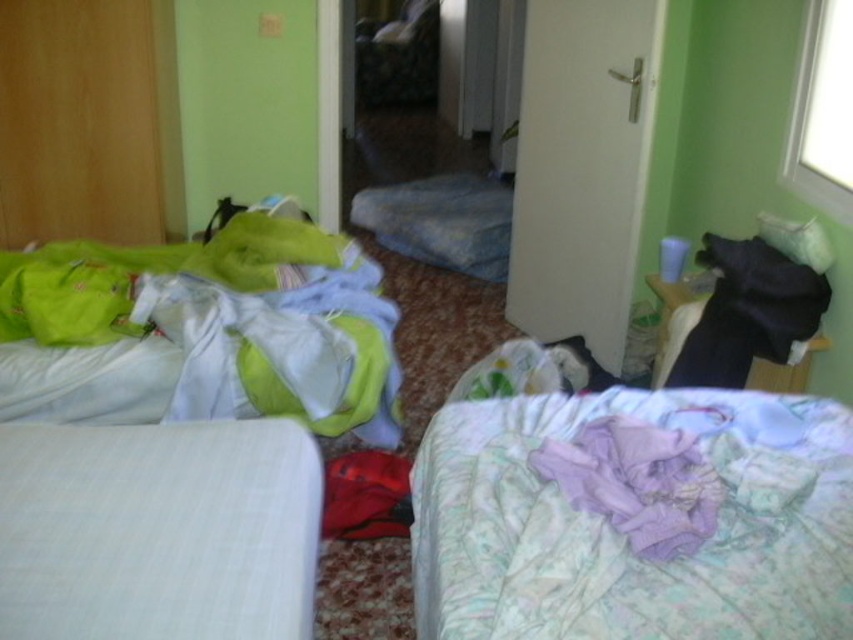
Question: Which of the following is the closest to the observer?

Choices:
 (A) matte green fabric at left
 (B) light purple floral blanket at lower right

Answer: (B)

Question: Considering the real-world distances, which object is closest to the white cotton bedcover at lower left?

Choices:
 (A) matte green fabric at left
 (B) light purple floral blanket at lower right

Answer: (B)

Question: Is matte green fabric at left below white cotton bedcover at lower left?

Choices:
 (A) no
 (B) yes

Answer: (A)

Question: Is light purple floral blanket at lower right smaller than white cotton bedcover at lower left?

Choices:
 (A) no
 (B) yes

Answer: (A)

Question: From the image, what is the correct spatial relationship of light purple floral blanket at lower right in relation to matte green fabric at left?

Choices:
 (A) below
 (B) above

Answer: (A)

Question: Which is farther from the matte green fabric at left?

Choices:
 (A) light purple floral blanket at lower right
 (B) white cotton bedcover at lower left

Answer: (A)